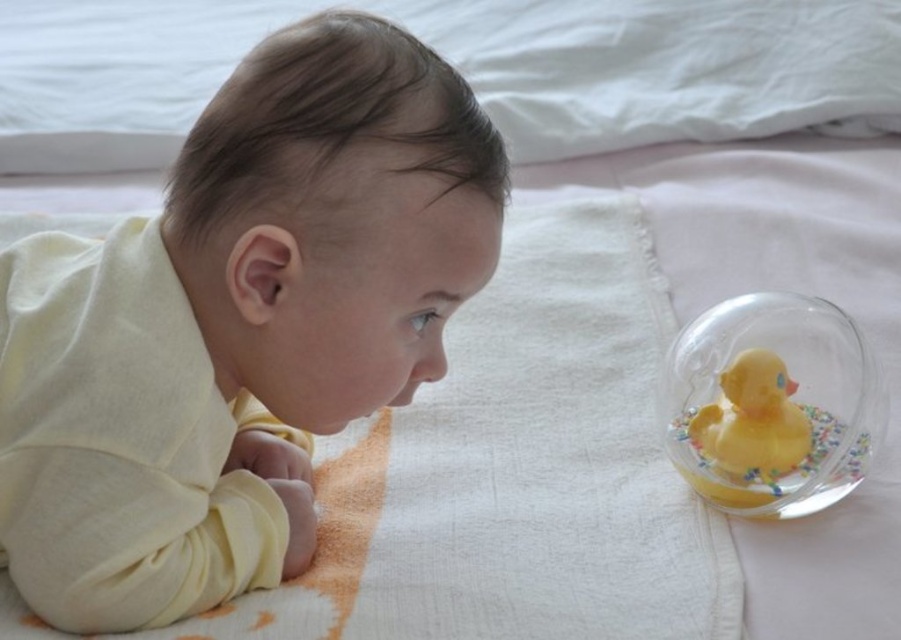
A baby is lying on a soft blanket and looking at a glass bowl with a yellow rubber duck. The baby is at point (87, 266). How far apart are the baby and the glass bowl?

The baby and the glass bowl are 33.71 inches apart.

What is located at the coordinates point (238, 324) in the image?

The coordinates point (238, 324) mark the location of the soft yellow fabric at center.

The baby is trying to reach for the yellow rubber duck at right. Since the transparent glass bowl at right is in the way, will the baby be able to see the duck over the bowl?

A: The transparent glass bowl at right is taller than the yellow rubber duck at right, so the bowl might block the baby from seeing the duck clearly.